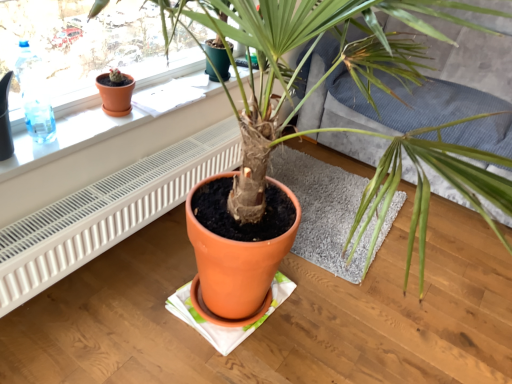
Where is `matte orange flowerpot at upper left`? The height and width of the screenshot is (384, 512). matte orange flowerpot at upper left is located at coordinates (116, 92).

This screenshot has width=512, height=384. What do you see at coordinates (361, 92) in the screenshot?
I see `terracotta pot at center` at bounding box center [361, 92].

Describe the element at coordinates (106, 212) in the screenshot. I see `white plastic radiator at lower left` at that location.

You are a GUI agent. You are given a task and a screenshot of the screen. Output one action in this format:
    pyautogui.click(x=<x>, y=<y>)
    Task: Click on the terracotta pot at upper left
    
    Given the screenshot: What is the action you would take?
    pyautogui.click(x=106, y=123)

Measure the distance between textured gray couch at center and camera.

textured gray couch at center is 5.46 feet away from camera.

What do you see at coordinates (393, 104) in the screenshot? I see `textured gray couch at center` at bounding box center [393, 104].

Consider the image. Measure the distance between point (28, 125) and camera.

They are 4.84 feet apart.

The height and width of the screenshot is (384, 512). What do you see at coordinates (34, 95) in the screenshot? I see `transparent plastic bottle at upper left` at bounding box center [34, 95].

You are a GUI agent. You are given a task and a screenshot of the screen. Output one action in this format:
    pyautogui.click(x=<x>, y=<y>)
    Task: Click on the matte orange flowerpot at upper left
    Image resolution: width=512 pixels, height=384 pixels.
    Given the screenshot: What is the action you would take?
    pyautogui.click(x=116, y=92)

Would you say white plastic radiator at lower left is outside textured gray couch at center?

white plastic radiator at lower left is positioned outside textured gray couch at center.

What's the angular difference between white plastic radiator at lower left and textured gray couch at center's facing directions?

There is a 89.3-degree angle between the facing directions of white plastic radiator at lower left and textured gray couch at center.

Considering the sizes of objects white plastic radiator at lower left and textured gray couch at center in the image provided, who is taller, white plastic radiator at lower left or textured gray couch at center?

Standing taller between the two is textured gray couch at center.

Which of these two, white plastic radiator at lower left or matte orange flowerpot at upper left, stands shorter?

matte orange flowerpot at upper left is shorter.

Measure the distance from white plastic radiator at lower left to matte orange flowerpot at upper left.

white plastic radiator at lower left is 15.35 inches from matte orange flowerpot at upper left.

Is white plastic radiator at lower left not inside matte orange flowerpot at upper left?

Yes, white plastic radiator at lower left is outside of matte orange flowerpot at upper left.

Does white plastic radiator at lower left have a greater width compared to matte orange flowerpot at upper left?

Correct, the width of white plastic radiator at lower left exceeds that of matte orange flowerpot at upper left.

Would you say textured gray couch at center is part of transparent plastic bottle at upper left's contents?

No, textured gray couch at center is not a part of transparent plastic bottle at upper left.

From the image's perspective, would you say transparent plastic bottle at upper left is shown under textured gray couch at center?

Yes, from the image's perspective, transparent plastic bottle at upper left is below textured gray couch at center.

From a real-world perspective, does transparent plastic bottle at upper left stand above textured gray couch at center?

Yes, from a real-world perspective, transparent plastic bottle at upper left is above textured gray couch at center.

Consider the image. Is transparent plastic bottle at upper left thinner than textured gray couch at center?

Yes, transparent plastic bottle at upper left is thinner than textured gray couch at center.

Can you confirm if terracotta pot at center is smaller than textured gray couch at center?

Indeed, terracotta pot at center has a smaller size compared to textured gray couch at center.

Between terracotta pot at center and textured gray couch at center, which one has smaller width?

With smaller width is terracotta pot at center.

Is terracotta pot at center taller than textured gray couch at center?

No, terracotta pot at center is not taller than textured gray couch at center.

From a real-world perspective, who is located lower, terracotta pot at center or white plastic radiator at lower left?

In real-world perspective, terracotta pot at center is lower.

Relative to white plastic radiator at lower left, is terracotta pot at center in front or behind?

Visually, terracotta pot at center is located behind white plastic radiator at lower left.

From the image's perspective, is terracotta pot at center over white plastic radiator at lower left?

No, from the image's perspective, terracotta pot at center is not on top of white plastic radiator at lower left.

In the scene shown: Between terracotta pot at center and white plastic radiator at lower left, which one has less height?

Standing shorter between the two is terracotta pot at center.

Would you say terracotta pot at upper left is a long distance from textured gray couch at center?

No, terracotta pot at upper left is not far from textured gray couch at center.

Between terracotta pot at upper left and textured gray couch at center, which one has more height?

textured gray couch at center is taller.

Can you confirm if terracotta pot at upper left is positioned to the right of textured gray couch at center?

In fact, terracotta pot at upper left is to the left of textured gray couch at center.

From the image's perspective, would you say terracotta pot at upper left is positioned over textured gray couch at center?

No, from the image's perspective, terracotta pot at upper left is not on top of textured gray couch at center.

How many degrees apart are the facing directions of terracotta pot at center and white plastic radiator at lower left?

They differ by 0.000152 degrees in their facing directions.

Which object is thinner, terracotta pot at center or white plastic radiator at lower left?

With smaller width is white plastic radiator at lower left.

In terms of height, does terracotta pot at center look taller or shorter compared to white plastic radiator at lower left?

In the image, terracotta pot at center appears to be taller than white plastic radiator at lower left.

Is terracotta pot at center next to white plastic radiator at lower left?

No.

At what (x,y) coordinates should I click in order to perform the action: click on air conditioner on the left of textured gray couch at center. Please return your answer as a coordinate pair (x, y). This screenshot has width=512, height=384. Looking at the image, I should click on (106, 212).

Identify the location of air conditioner below the matte orange flowerpot at upper left (from a real-world perspective). The height and width of the screenshot is (384, 512). (106, 212).

When comparing their distances from transparent plastic bottle at upper left, does terracotta pot at center or matte orange flowerpot at upper left seem closer?

matte orange flowerpot at upper left is positioned closer to the anchor transparent plastic bottle at upper left.

Estimate the real-world distances between objects in this image. Which object is further from white plastic radiator at lower left, matte orange flowerpot at upper left or textured gray couch at center?

textured gray couch at center.

Considering their positions, is terracotta pot at center positioned further to matte orange flowerpot at upper left than transparent plastic bottle at upper left?

terracotta pot at center is further to matte orange flowerpot at upper left.

Based on their spatial positions, is terracotta pot at center or white plastic radiator at lower left closer to transparent plastic bottle at upper left?

white plastic radiator at lower left is positioned closer to the anchor transparent plastic bottle at upper left.

When comparing their distances from terracotta pot at center, does terracotta pot at center or terracotta pot at upper left seem further?

The object further to terracotta pot at center is terracotta pot at upper left.

From the image, which object appears to be nearer to textured gray couch at center, white plastic radiator at lower left or transparent plastic bottle at upper left?

Based on the image, white plastic radiator at lower left appears to be nearer to textured gray couch at center.

Looking at the image, which one is located closer to terracotta pot at center, terracotta pot at center or white plastic radiator at lower left?

terracotta pot at center.

From the image, which object appears to be nearer to white plastic radiator at lower left, transparent plastic bottle at upper left or terracotta pot at center?

transparent plastic bottle at upper left is positioned closer to the anchor white plastic radiator at lower left.

Image resolution: width=512 pixels, height=384 pixels. What are the coordinates of `flowerpot between transparent plastic bottle at upper left and terracotta pot at center` in the screenshot? It's located at (116, 92).

Find the location of a particular element. bottle between matte orange flowerpot at upper left and white plastic radiator at lower left from top to bottom is located at coordinates (34, 95).

Find the location of a particular element. This screenshot has width=512, height=384. window sill between transparent plastic bottle at upper left and white plastic radiator at lower left from left to right is located at coordinates (106, 123).

Where is `flowerpot between terracotta pot at center and terracotta pot at center in the front-back direction`? The height and width of the screenshot is (384, 512). flowerpot between terracotta pot at center and terracotta pot at center in the front-back direction is located at coordinates 116,92.